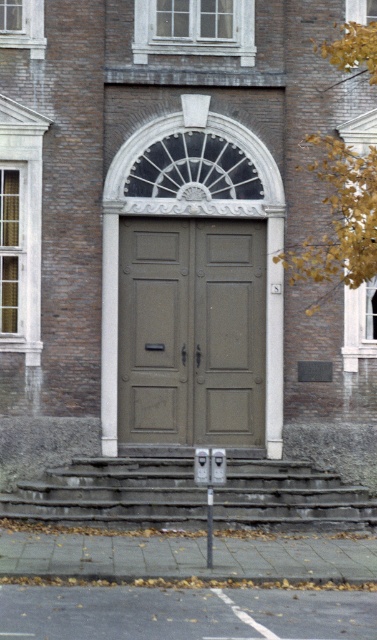
Question: Is matte wood door at center below gray stone stairs at center?

Choices:
 (A) no
 (B) yes

Answer: (A)

Question: Does matte wood door at center have a larger size compared to gray stone stairs at center?

Choices:
 (A) yes
 (B) no

Answer: (B)

Question: Does matte wood door at center have a lesser width compared to gray stone stairs at center?

Choices:
 (A) no
 (B) yes

Answer: (B)

Question: Which point appears farthest from the camera in this image?

Choices:
 (A) (82, 472)
 (B) (211, 412)

Answer: (B)

Question: Which point is closer to the camera taking this photo?

Choices:
 (A) (327, 481)
 (B) (191, 301)

Answer: (A)